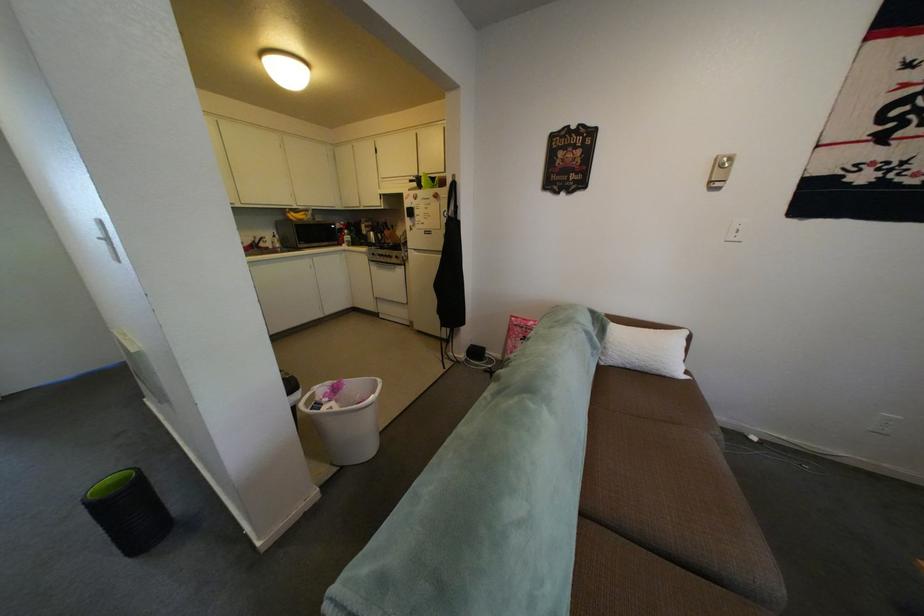
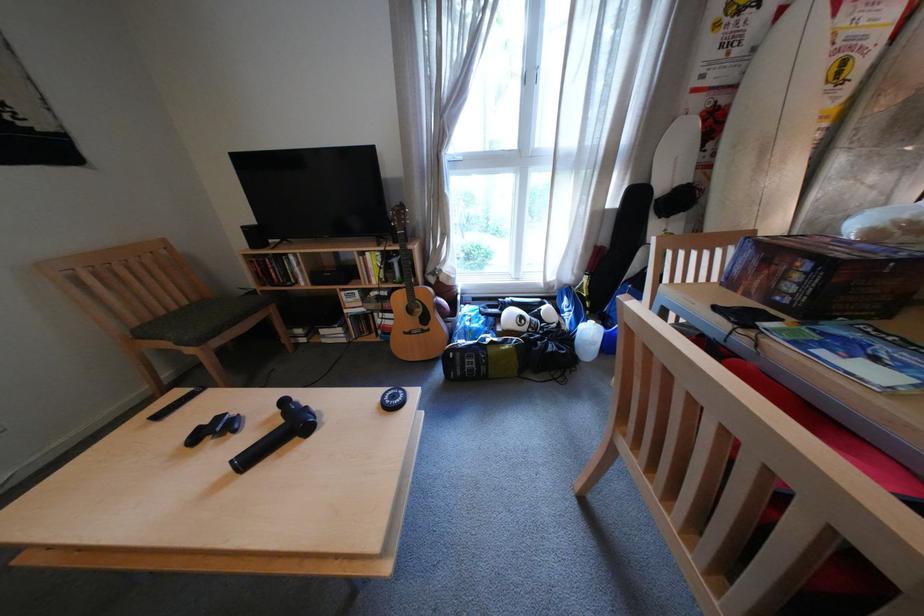
First-person continuous shooting, in which direction is the camera rotating?

Result: The camera's rotation is toward right-down.